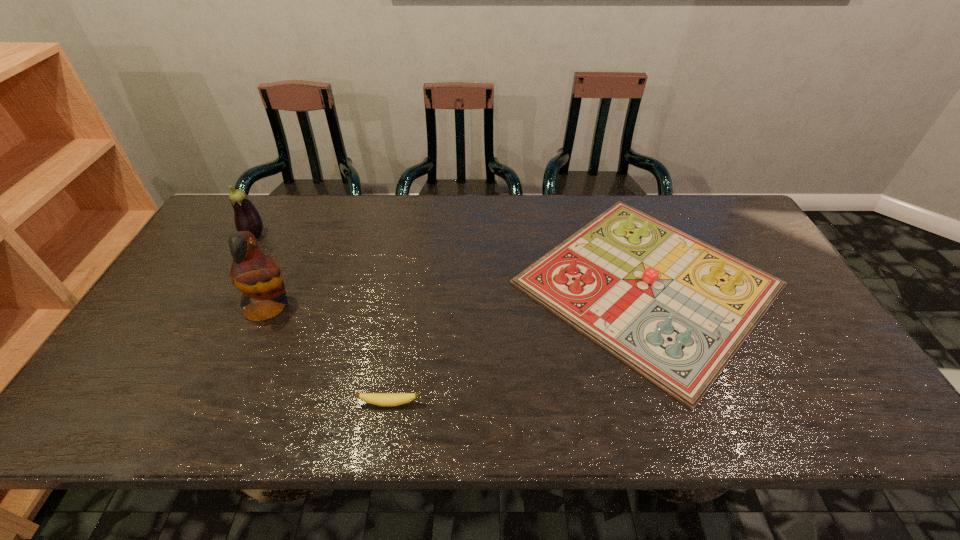
What are the coordinates of `the tallest object` in the screenshot? It's located at (254, 273).

You are a GUI agent. You are given a task and a screenshot of the screen. Output one action in this format:
    pyautogui.click(x=<x>, y=<y>)
    Task: Click on the parrot
    Image resolution: width=960 pixels, height=540 pixels.
    Given the screenshot: What is the action you would take?
    pyautogui.click(x=254, y=273)

In order to click on eggplant in this screenshot , I will do [x=246, y=216].

At what (x,y) coordinates should I click in order to perform the action: click on the leftmost object. Please return your answer as a coordinate pair (x, y). Looking at the image, I should click on (246, 216).

The height and width of the screenshot is (540, 960). Find the location of `gameboard`. gameboard is located at coordinates (675, 309).

Identify the location of the third tallest object. (675, 309).

Find the location of a particular element. Image resolution: width=960 pixels, height=540 pixels. the shortest object is located at coordinates (381, 399).

The image size is (960, 540). I want to click on the second object from right to left, so click(x=381, y=399).

Where is `free space located on the face of the third object from right to left`? The height and width of the screenshot is (540, 960). free space located on the face of the third object from right to left is located at coordinates (385, 307).

Find the location of a particular element. This screenshot has width=960, height=540. vacant space located 0.400m on the right of the leftmost object is located at coordinates (393, 235).